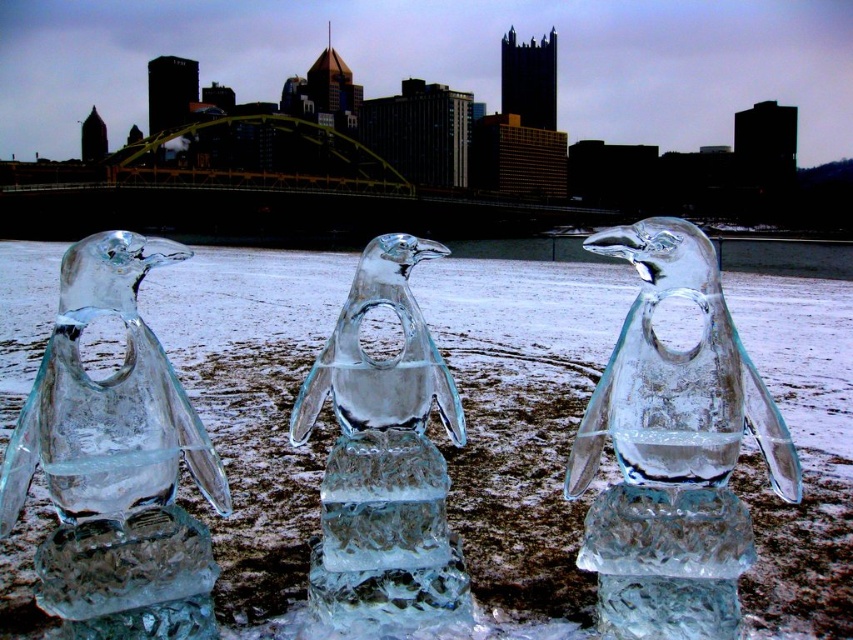
Question: Which point is closer to the camera taking this photo?

Choices:
 (A) (167, 552)
 (B) (329, 480)
 (C) (770, 448)

Answer: (A)

Question: Which object is farther from the camera taking this photo?

Choices:
 (A) transparent ice penguin at right
 (B) transparent ice penguin at left
 (C) transparent ice sculpture at center
 (D) transparent ice penguin at center

Answer: (D)

Question: Estimate the real-world distances between objects in this image. Which object is farther from the transparent ice penguin at left?

Choices:
 (A) transparent ice penguin at right
 (B) transparent ice penguin at center

Answer: (A)

Question: Does transparent ice penguin at left appear under transparent ice penguin at center?

Choices:
 (A) yes
 (B) no

Answer: (A)

Question: Is transparent ice sculpture at center to the left of transparent ice penguin at right from the viewer's perspective?

Choices:
 (A) yes
 (B) no

Answer: (A)

Question: Is transparent ice sculpture at center behind transparent ice penguin at left?

Choices:
 (A) no
 (B) yes

Answer: (B)